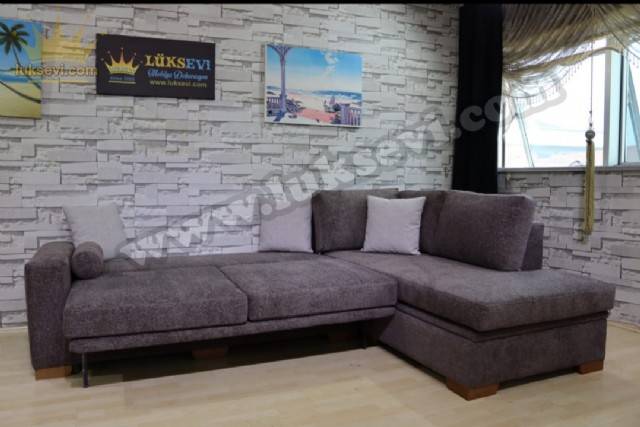
What are the coordinates of `tassel` in the screenshot? It's located at (592, 141).